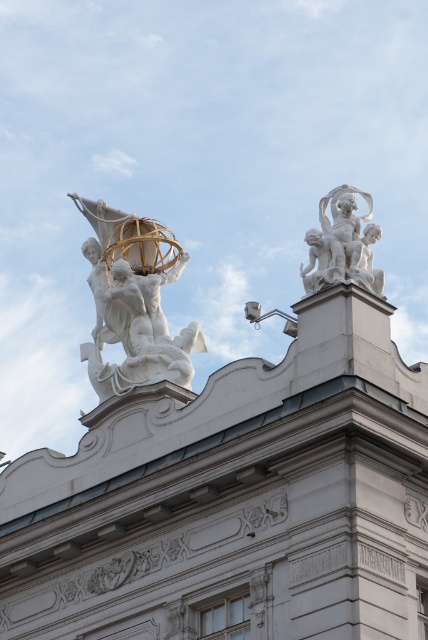
Who is positioned more to the right, white marble statue at upper left or white marble cherubs at upper right?

Positioned to the right is white marble cherubs at upper right.

Image resolution: width=428 pixels, height=640 pixels. I want to click on white marble statue at upper left, so click(x=133, y=301).

At what (x,y) coordinates should I click in order to perform the action: click on white marble statue at upper left. Please return your answer as a coordinate pair (x, y). The height and width of the screenshot is (640, 428). Looking at the image, I should click on (133, 301).